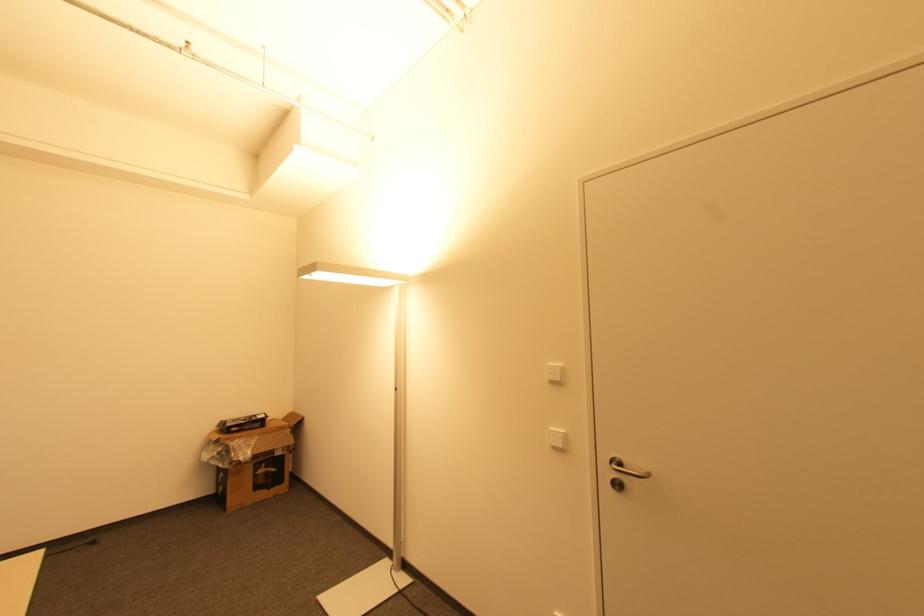
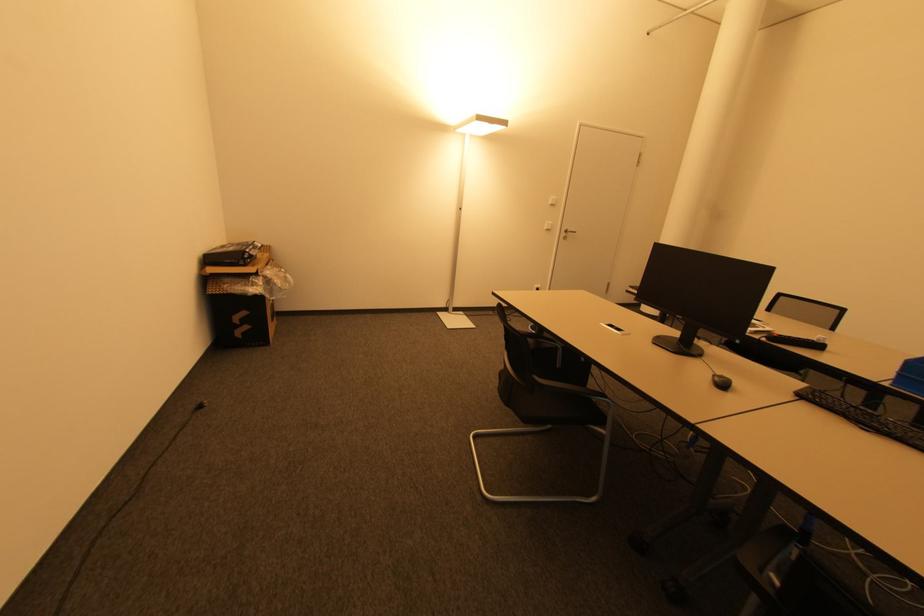
Find the pixel in the second image that matches point 612,474 in the first image.

(565, 235)